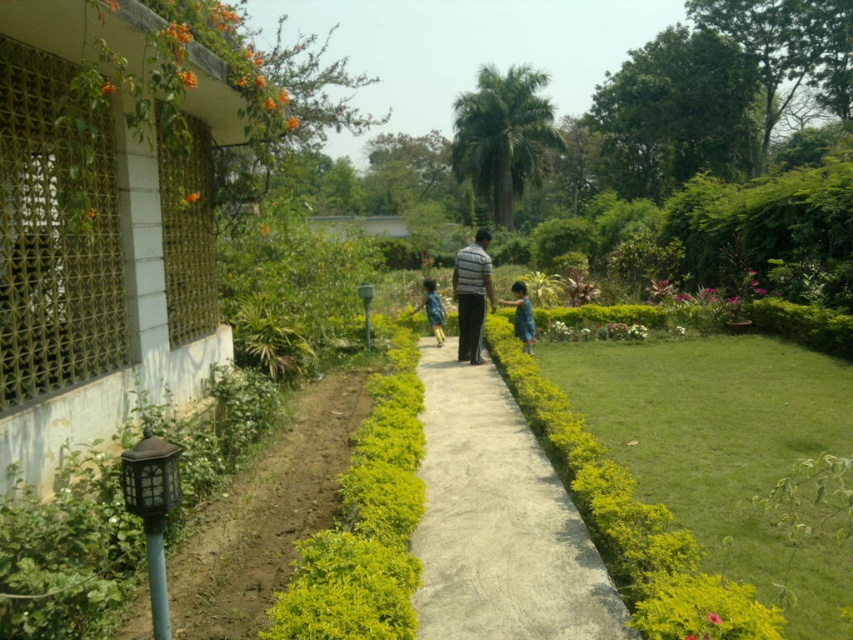
Is point (461, 317) behind point (430, 317)?

No, it is not.

Based on the photo, is striped fabric man at center shorter than blue denim shorts at center?

Incorrect, striped fabric man at center's height does not fall short of blue denim shorts at center's.

What do you see at coordinates (473, 294) in the screenshot? I see `striped fabric man at center` at bounding box center [473, 294].

In order to click on striped fabric man at center in this screenshot , I will do `click(473, 294)`.

Does green matte dress at center have a greater height compared to blue denim shorts at center?

No, green matte dress at center is not taller than blue denim shorts at center.

Can you confirm if green matte dress at center is smaller than blue denim shorts at center?

Yes, green matte dress at center is smaller than blue denim shorts at center.

The height and width of the screenshot is (640, 853). I want to click on green matte dress at center, so click(521, 314).

Identify the location of green matte dress at center. This screenshot has width=853, height=640. (521, 314).

Who is more distant from viewer, (444,384) or (438,323)?

Positioned behind is point (438,323).

You are a GUI agent. You are given a task and a screenshot of the screen. Output one action in this format:
    pyautogui.click(x=<x>, y=<y>)
    Task: Click on the smooth concrete path at center
    
    Given the screenshot: What is the action you would take?
    pyautogui.click(x=498, y=522)

The width and height of the screenshot is (853, 640). Identify the location of smooth concrete path at center. (498, 522).

Identify the location of smooth concrete path at center. (498, 522).